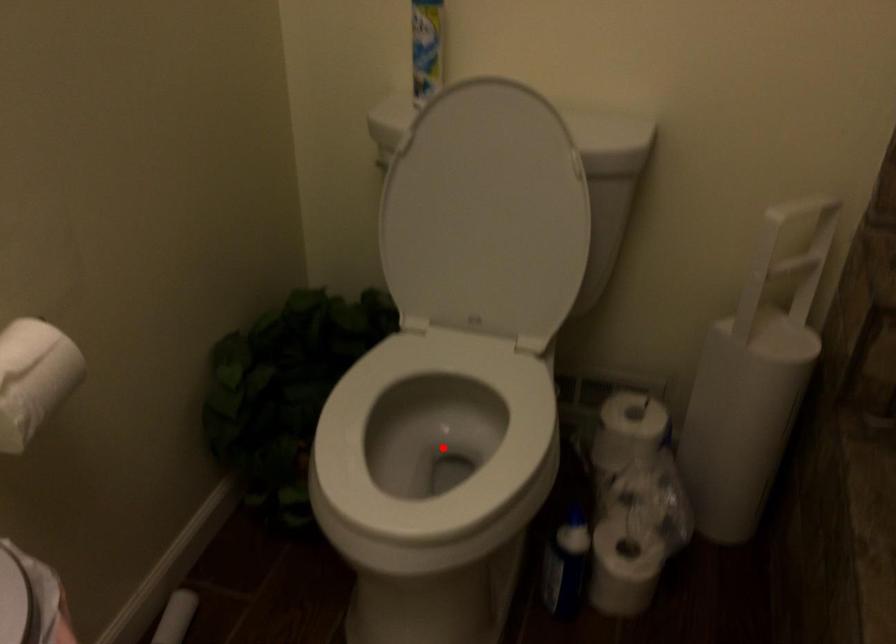
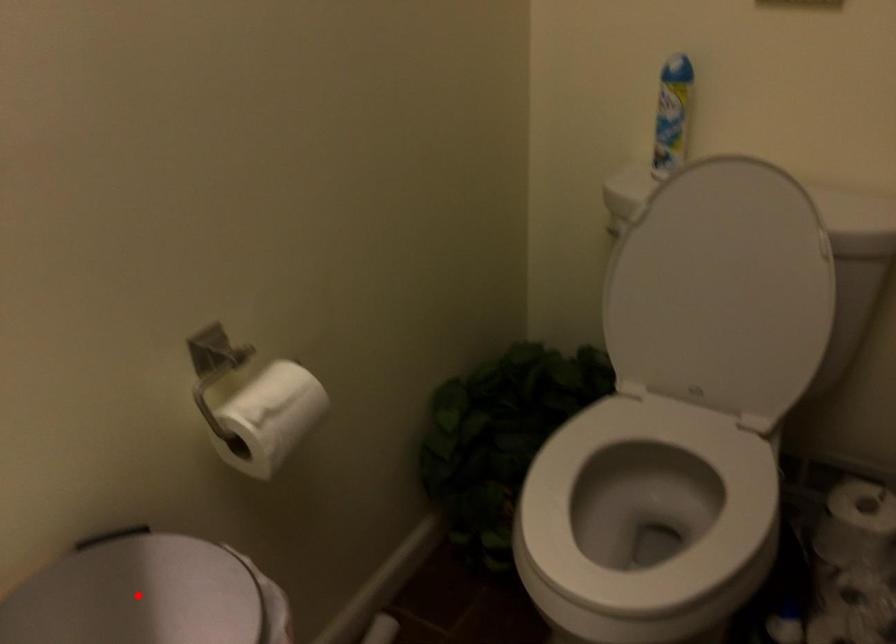
I am providing you with two images of the same scene from different viewpoints. A red point is marked on the first image and another point is marked on the second image. Is the marked point in image1 the same physical position as the marked point in image2?

No